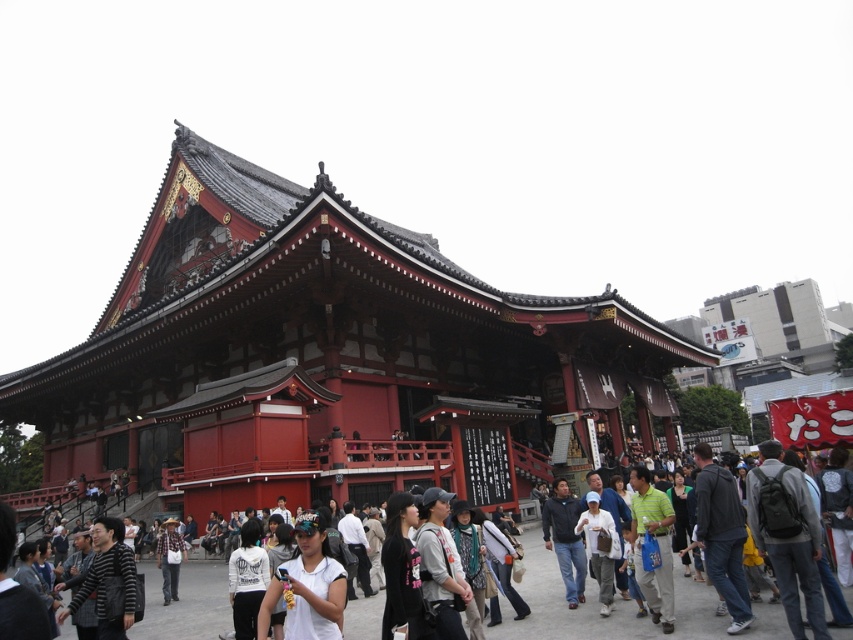
You are standing at the entrance of the temple and want to take a photo of both the temple and the crowd. You notice two points marked in the scene. The first point is at coordinate point [410,493] and the second is at coordinate point [120,621]. Which point should you focus on to ensure both the temple and the crowd are in the frame?

You should focus on point [120,621] because point [410,493] is behind it, so focusing on the closer point will keep both the temple and the crowd in view.

You are standing at the temple entrance and want to take a photo of the point at coordinate point (311, 516). If your camera has a maximum focus range of 35 meters, will you be able to focus on that point?

The distance of point (311, 516) from the camera is 37.14 meters, which exceeds the camera maximum focus range of 35 meters. Therefore, you won not be able to focus on that point.